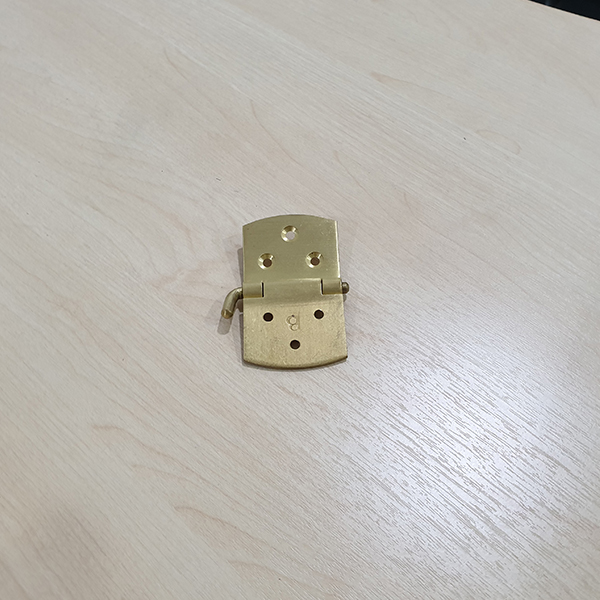
In order to click on screw holes in this screenshot , I will do `click(269, 318)`, `click(320, 310)`, `click(292, 345)`, `click(267, 259)`, `click(316, 259)`, `click(294, 232)`.